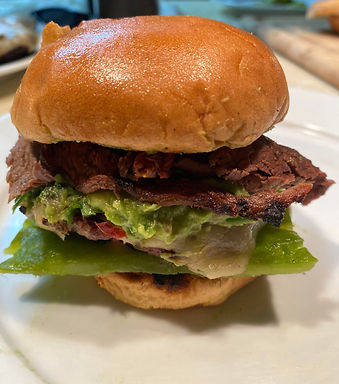
The image size is (339, 384). What are the coordinates of `counter top table` in the screenshot? It's located at (307, 139).